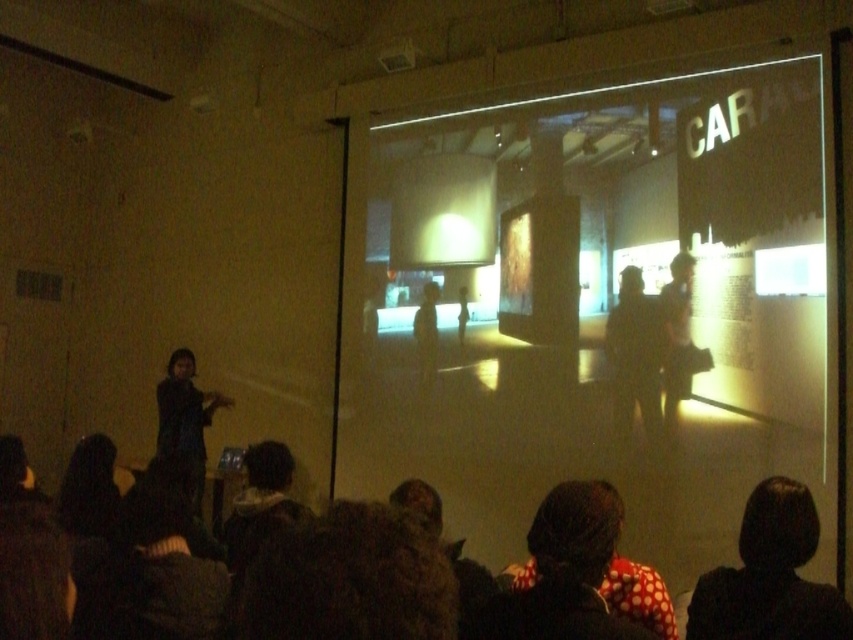
Question: Can you confirm if dark hair at lower right is positioned above dark fabric bag at center?

Choices:
 (A) yes
 (B) no

Answer: (B)

Question: Does matte white screen at center have a smaller size compared to dark fabric bag at center?

Choices:
 (A) yes
 (B) no

Answer: (B)

Question: Among these points, which one is farthest from the camera?

Choices:
 (A) (606, 486)
 (B) (782, 627)
 (C) (190, 490)
 (D) (625, 305)

Answer: (D)

Question: Estimate the real-world distances between objects in this image. Which object is closer to the dark hair at lower right?

Choices:
 (A) polka dot scarf at center
 (B) dark fabric dress at left
 (C) dark gray fabric mannequin at center
 (D) dark fabric bag at center

Answer: (A)

Question: Which object is positioned farthest from the matte white screen at center?

Choices:
 (A) dark fabric jacket at center
 (B) dark fabric dress at left
 (C) polka dot scarf at center

Answer: (C)

Question: Does dark fabric jacket at center appear over dark fabric dress at left?

Choices:
 (A) no
 (B) yes

Answer: (B)